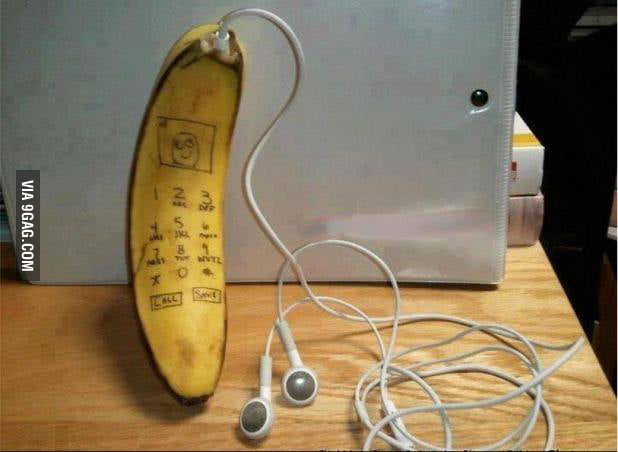
In order to click on white cord in this screenshot , I will do `click(384, 263)`.